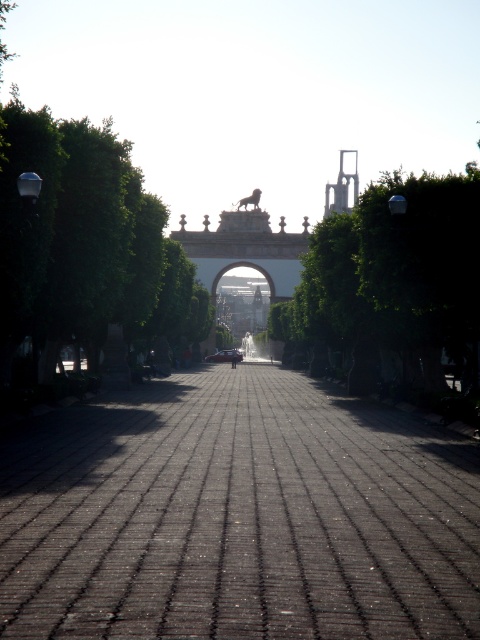
In the scene shown: You are a photographer planning to take a picture of the grand archway. You notice a green leafy tree at center and a shiny red car at center blocking the view. Which object should you move to get a clear view of the archway?

You should move the shiny red car at center because the green leafy tree at center is larger and might be harder to move. Alternatively, since both are at the center, moving either could help, but the car is more likely movable.

You are standing at the starting point of the pathway and want to reach the archway. According to the image, where exactly is the dark brick pathway at center located?

The dark brick pathway at center is located at point [237,516].